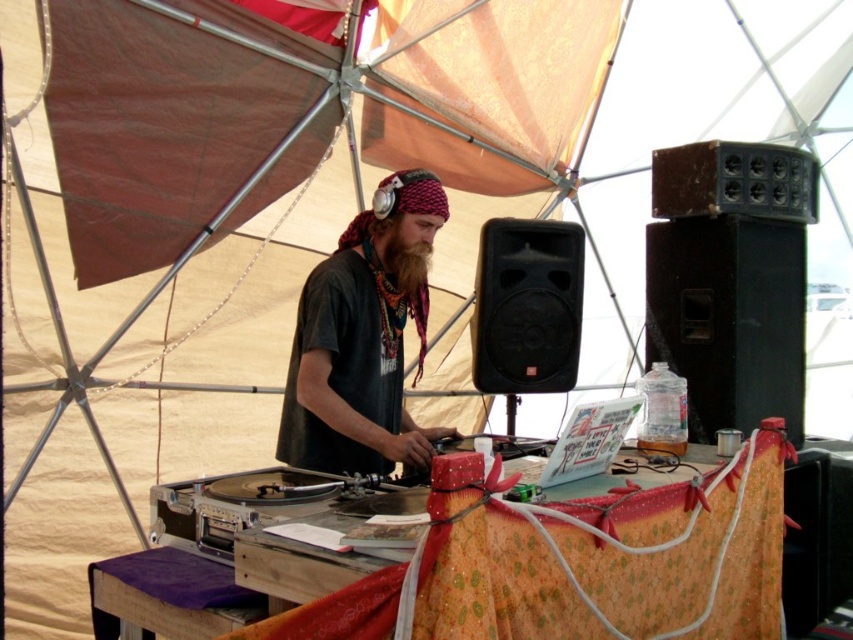
Question: Which object is the closest to the black matte speaker at center?

Choices:
 (A) black plastic speaker at right
 (B) black matte shirt at center
 (C) brown fuzzy beard at center

Answer: (A)

Question: Which of these objects is positioned farthest from the black plastic speaker at right?

Choices:
 (A) black matte speaker at center
 (B) black matte shirt at center

Answer: (B)

Question: Can you confirm if black matte shirt at center is smaller than brown fuzzy beard at center?

Choices:
 (A) no
 (B) yes

Answer: (A)

Question: Is black matte shirt at center in front of black plastic speaker at right?

Choices:
 (A) yes
 (B) no

Answer: (A)

Question: Is black plastic speaker at right positioned in front of brown fuzzy beard at center?

Choices:
 (A) no
 (B) yes

Answer: (A)

Question: Which point is closer to the camera taking this photo?

Choices:
 (A) (701, 408)
 (B) (407, 285)
 (C) (346, 348)

Answer: (C)